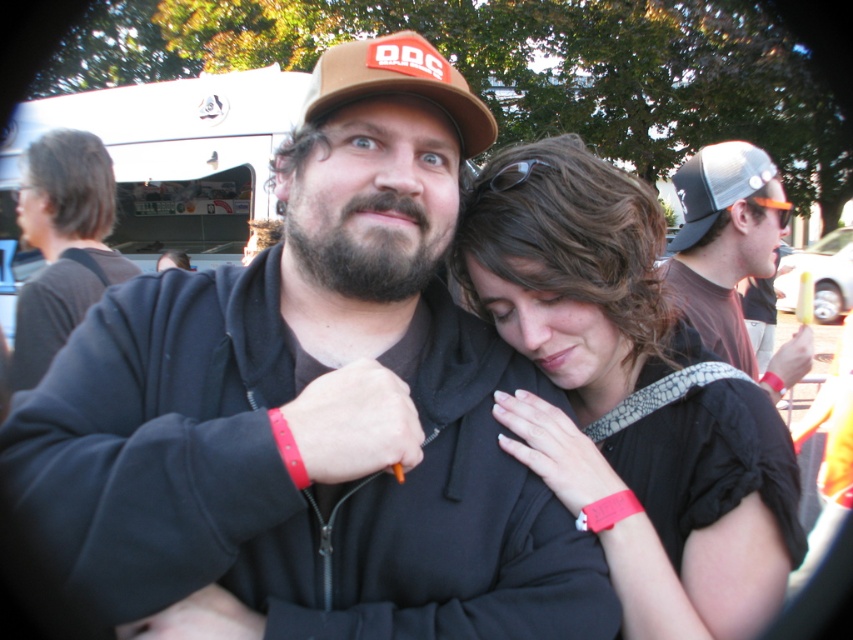
You are a photographer setting up for a group photo. You have a camera with a 50mm lens and want to ensure both the black matte jacket at center and the brown fabric baseball cap at upper center are in focus. Given that the depth of field at this lens setting allows objects within 15 inches of each other to be in focus, will both objects be in focus?

The black matte jacket at center and brown fabric baseball cap at upper center are 17.76 inches apart from each other. Since the depth of field only allows objects within 15 inches to be in focus, they will not both be in focus with the current lens setting.

You are standing at point (310, 410) in the image. What object is located exactly at this point?

The black matte jacket at center is located exactly at point (310, 410).